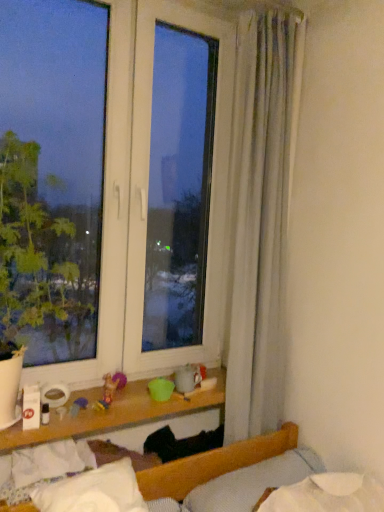
Identify the location of white soft pillow at lower center, the second pillow in the right-to-left sequence. (93, 490).

This screenshot has width=384, height=512. What do you see at coordinates (93, 490) in the screenshot?
I see `white soft pillow at lower center, the second pillow in the right-to-left sequence` at bounding box center [93, 490].

What is the approximate height of white soft pillow at lower right, the second pillow when ordered from left to right?

The height of white soft pillow at lower right, the second pillow when ordered from left to right, is 6.06 inches.

This screenshot has width=384, height=512. What do you see at coordinates (252, 482) in the screenshot?
I see `white soft pillow at lower right, the second pillow when ordered from left to right` at bounding box center [252, 482].

Locate an element on the screen. The height and width of the screenshot is (512, 384). white soft pillow at lower right, the 1th pillow when ordered from right to left is located at coordinates (252, 482).

Locate an element on the screen. This screenshot has height=512, width=384. white soft pillow at lower center, which is the first pillow from left to right is located at coordinates (93, 490).

In the scene shown: Between white soft pillow at lower center, the second pillow in the right-to-left sequence, and white soft pillow at lower right, the 1th pillow when ordered from right to left, which one appears on the right side from the viewer's perspective?

From the viewer's perspective, white soft pillow at lower right, the 1th pillow when ordered from right to left, appears more on the right side.

Considering their positions, is white soft pillow at lower center, the second pillow in the right-to-left sequence, located in front of or behind white soft pillow at lower right, the 1th pillow when ordered from right to left?

In the image, white soft pillow at lower center, the second pillow in the right-to-left sequence, appears in front of white soft pillow at lower right, the 1th pillow when ordered from right to left.

Considering the positions of points (99, 478) and (234, 488), is point (99, 478) closer to camera compared to point (234, 488)?

Yes.

Based on the photo, from the image's perspective, which one is positioned higher, white soft pillow at lower center, which is the first pillow from left to right, or white soft pillow at lower right, the second pillow when ordered from left to right?

white soft pillow at lower center, which is the first pillow from left to right.

From a real-world perspective, who is located lower, white soft pillow at lower center, which is the first pillow from left to right, or white soft pillow at lower right, the second pillow when ordered from left to right?

white soft pillow at lower center, which is the first pillow from left to right, from a real-world perspective.

Does white soft pillow at lower center, which is the first pillow from left to right, have a lesser width compared to white soft pillow at lower right, the second pillow when ordered from left to right?

No.

Does white soft pillow at lower center, which is the first pillow from left to right, have a greater height compared to white soft pillow at lower right, the second pillow when ordered from left to right?

Incorrect, the height of white soft pillow at lower center, which is the first pillow from left to right, is not larger of that of white soft pillow at lower right, the second pillow when ordered from left to right.

Considering the sizes of objects white soft pillow at lower center, the second pillow in the right-to-left sequence, and white soft pillow at lower right, the second pillow when ordered from left to right, in the image provided, who is smaller, white soft pillow at lower center, the second pillow in the right-to-left sequence, or white soft pillow at lower right, the second pillow when ordered from left to right,?

With smaller size is white soft pillow at lower center, the second pillow in the right-to-left sequence.

Is white soft pillow at lower center, which is the first pillow from left to right, surrounding white soft pillow at lower right, the 1th pillow when ordered from right to left?

No, white soft pillow at lower right, the 1th pillow when ordered from right to left, is located outside of white soft pillow at lower center, which is the first pillow from left to right.

In the scene shown: Are white soft pillow at lower center, the second pillow in the right-to-left sequence, and white soft pillow at lower right, the 1th pillow when ordered from right to left, making contact?

There is a gap between white soft pillow at lower center, the second pillow in the right-to-left sequence, and white soft pillow at lower right, the 1th pillow when ordered from right to left.

Could you tell me if white soft pillow at lower center, the second pillow in the right-to-left sequence, is facing white soft pillow at lower right, the 1th pillow when ordered from right to left?

No, white soft pillow at lower center, the second pillow in the right-to-left sequence, is not facing towards white soft pillow at lower right, the 1th pillow when ordered from right to left.

Locate an element on the screen. The height and width of the screenshot is (512, 384). pillow on the left of white soft pillow at lower right, the second pillow when ordered from left to right is located at coordinates (93, 490).

Would you say white soft pillow at lower right, the second pillow when ordered from left to right, is to the left or to the right of white soft pillow at lower center, the second pillow in the right-to-left sequence, in the picture?

In the image, white soft pillow at lower right, the second pillow when ordered from left to right, appears on the right side of white soft pillow at lower center, the second pillow in the right-to-left sequence.

Between white soft pillow at lower right, the 1th pillow when ordered from right to left, and white soft pillow at lower center, the second pillow in the right-to-left sequence, which one is positioned behind?

white soft pillow at lower right, the 1th pillow when ordered from right to left, is further from the camera.

Considering the positions of point (229, 472) and point (116, 477), is point (229, 472) closer or farther from the camera than point (116, 477)?

Point (229, 472) is positioned farther from the camera compared to point (116, 477).

Looking at this image, from the image's perspective, between white soft pillow at lower right, the second pillow when ordered from left to right, and white soft pillow at lower center, the second pillow in the right-to-left sequence, who is located below?

white soft pillow at lower right, the second pillow when ordered from left to right.

From a real-world perspective, which object stands above the other?

white soft pillow at lower right, the 1th pillow when ordered from right to left, from a real-world perspective.

Considering the sizes of white soft pillow at lower right, the 1th pillow when ordered from right to left, and white soft pillow at lower center, the second pillow in the right-to-left sequence, in the image, is white soft pillow at lower right, the 1th pillow when ordered from right to left, wider or thinner than white soft pillow at lower center, the second pillow in the right-to-left sequence,?

Clearly, white soft pillow at lower right, the 1th pillow when ordered from right to left, has less width compared to white soft pillow at lower center, the second pillow in the right-to-left sequence.

Is white soft pillow at lower right, the second pillow when ordered from left to right, shorter than white soft pillow at lower center, the second pillow in the right-to-left sequence?

No, white soft pillow at lower right, the second pillow when ordered from left to right, is not shorter than white soft pillow at lower center, the second pillow in the right-to-left sequence.

Looking at the image, does white soft pillow at lower right, the 1th pillow when ordered from right to left, seem bigger or smaller compared to white soft pillow at lower center, the second pillow in the right-to-left sequence?

Clearly, white soft pillow at lower right, the 1th pillow when ordered from right to left, is larger in size than white soft pillow at lower center, the second pillow in the right-to-left sequence.

Choose the correct answer: Is white soft pillow at lower right, the second pillow when ordered from left to right, inside white soft pillow at lower center, the second pillow in the right-to-left sequence, or outside it?

white soft pillow at lower right, the second pillow when ordered from left to right, cannot be found inside white soft pillow at lower center, the second pillow in the right-to-left sequence.

Is white soft pillow at lower right, the second pillow when ordered from left to right, far from white soft pillow at lower center, which is the first pillow from left to right?

white soft pillow at lower right, the second pillow when ordered from left to right, is near white soft pillow at lower center, which is the first pillow from left to right, not far away.

Is white soft pillow at lower right, the 1th pillow when ordered from right to left, turned away from white soft pillow at lower center, which is the first pillow from left to right?

No, white soft pillow at lower center, which is the first pillow from left to right, is not at the back of white soft pillow at lower right, the 1th pillow when ordered from right to left.

What's the angular difference between white soft pillow at lower right, the second pillow when ordered from left to right, and white soft pillow at lower center, the second pillow in the right-to-left sequence,'s facing directions?

There is a 2.31-degree angle between the facing directions of white soft pillow at lower right, the second pillow when ordered from left to right, and white soft pillow at lower center, the second pillow in the right-to-left sequence.

Could you measure the distance between white soft pillow at lower right, the 1th pillow when ordered from right to left, and white soft pillow at lower center, the second pillow in the right-to-left sequence?

white soft pillow at lower right, the 1th pillow when ordered from right to left, and white soft pillow at lower center, the second pillow in the right-to-left sequence, are 16.90 inches apart from each other.

Where is `pillow lying below the white soft pillow at lower center, which is the first pillow from left to right (from the image's perspective)`? The height and width of the screenshot is (512, 384). pillow lying below the white soft pillow at lower center, which is the first pillow from left to right (from the image's perspective) is located at coordinates (252, 482).

This screenshot has width=384, height=512. Identify the location of pillow that appears above the white soft pillow at lower center, the second pillow in the right-to-left sequence (from a real-world perspective). (252, 482).

Identify the location of pillow behind the white soft pillow at lower center, which is the first pillow from left to right. (252, 482).